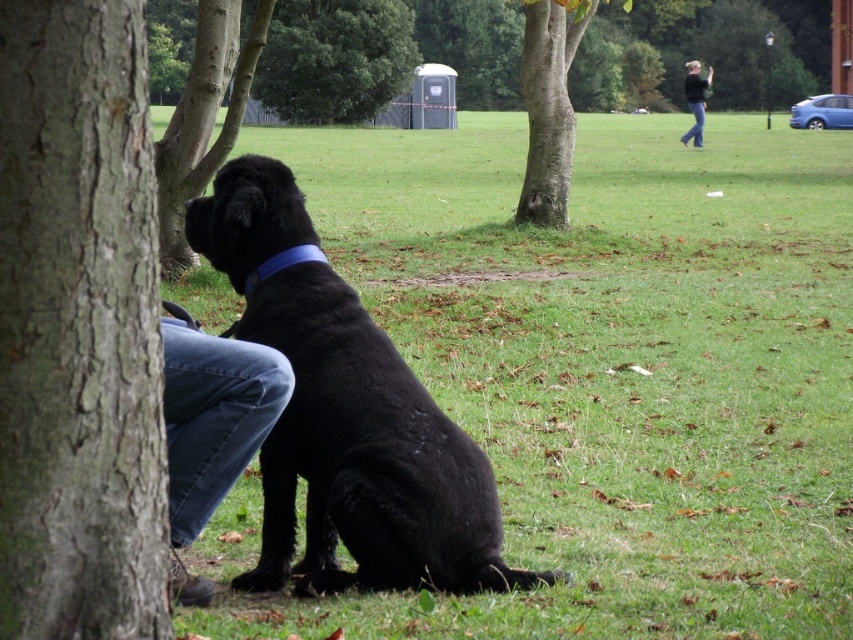
You are standing at the point labeled as point (688, 131) in the park scene. You want to walk straight towards the direction where the black dog is sitting. Will you pass through the point labeled as point (144, 605) before reaching the dog?

Yes, since point (144, 605) is in front of point (688, 131), walking towards the dog would mean passing through point (144, 605) first before reaching the dog.

You are standing at point (206, 515) and want to walk to point (229, 211). Which direction should you face to move towards your destination?

To move from point (206, 515) to point (229, 211), you should face towards the left direction since point (229, 211) is behind point (206, 515).

Consider the image. You are a photographer trying to capture the black matte dog at lower left in the center of your photo. Given its current position at point 0.655, 0.407, should you move your camera to the left or right to center the dog?

Since the black matte dog at lower left is located at coordinate 0.655 on the x axis, which is to the right of the center point 0.5, you should move your camera to the right to bring the dog closer to the frame center.